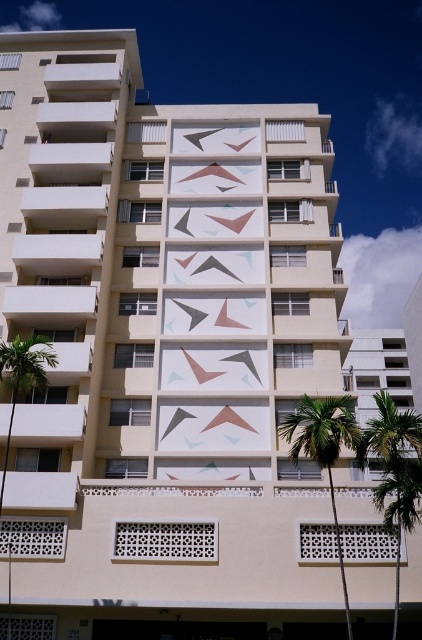
You are standing at the entrance of the building and want to plant a new palm tree in the exact same 2D location as the green leafy palm tree at lower right. What coordinates should you use?

The coordinates for the green leafy palm tree at lower right are at point (324, 449). You should use these coordinates to plant the new palm tree.